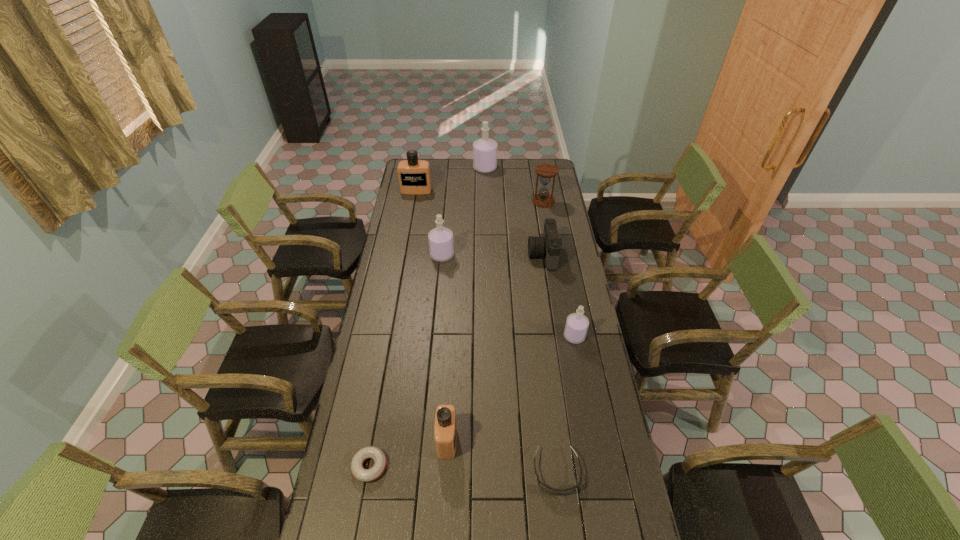
You are a GUI agent. You are given a task and a screenshot of the screen. Output one action in this format:
    pyautogui.click(x=<x>, y=<y>)
    Task: Click on the smallest purple perfume
    The height and width of the screenshot is (540, 960).
    Given the screenshot: What is the action you would take?
    pyautogui.click(x=576, y=327)

Where is `the third shortest object`? the third shortest object is located at coordinates click(548, 246).

Locate an element on the screen. This screenshot has height=540, width=960. the eighth tallest object is located at coordinates (551, 490).

Find the location of a particular element. The width and height of the screenshot is (960, 540). goggles is located at coordinates (551, 490).

You are a GUI agent. You are given a task and a screenshot of the screen. Output one action in this format:
    pyautogui.click(x=<x>, y=<y>)
    Task: Click on the doughnut
    The width and height of the screenshot is (960, 540).
    Given the screenshot: What is the action you would take?
    pyautogui.click(x=365, y=475)

The image size is (960, 540). In order to click on free region located 0.070m on the left of the tallest perfume in this screenshot , I will do `click(462, 168)`.

This screenshot has height=540, width=960. What are the coordinates of `free point located 0.310m on the right of the third nearest perfume` in the screenshot? It's located at (518, 255).

Find the location of `vacant space located 0.200m on the front label of the left beige perfume`. vacant space located 0.200m on the front label of the left beige perfume is located at coordinates (412, 217).

Where is `free space located 0.120m on the left of the hourglass`? free space located 0.120m on the left of the hourglass is located at coordinates (511, 201).

You are a GUI agent. You are given a task and a screenshot of the screen. Output one action in this format:
    pyautogui.click(x=<x>, y=<y>)
    Task: Click on the free space located on the front label of the right beige perfume
    
    Given the screenshot: What is the action you would take?
    pyautogui.click(x=534, y=440)